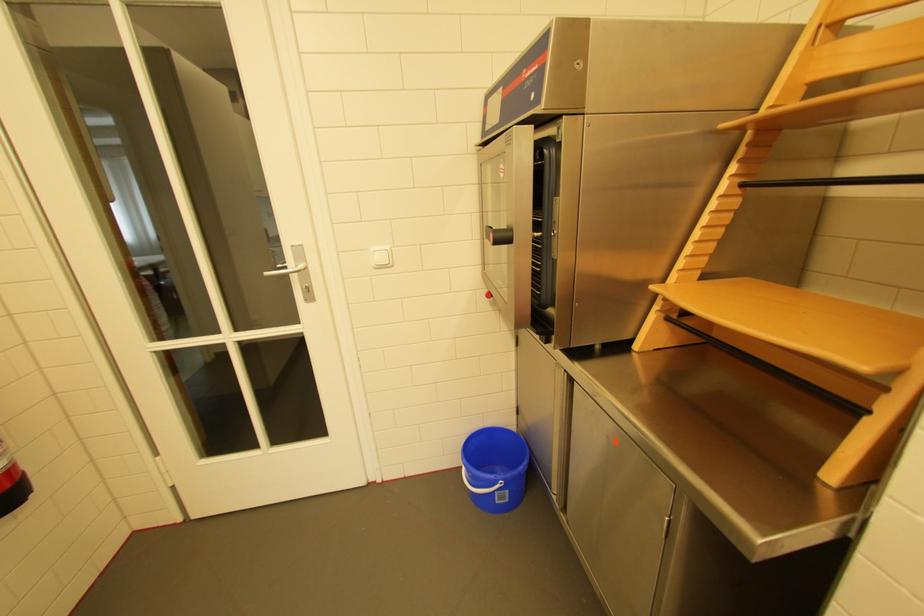
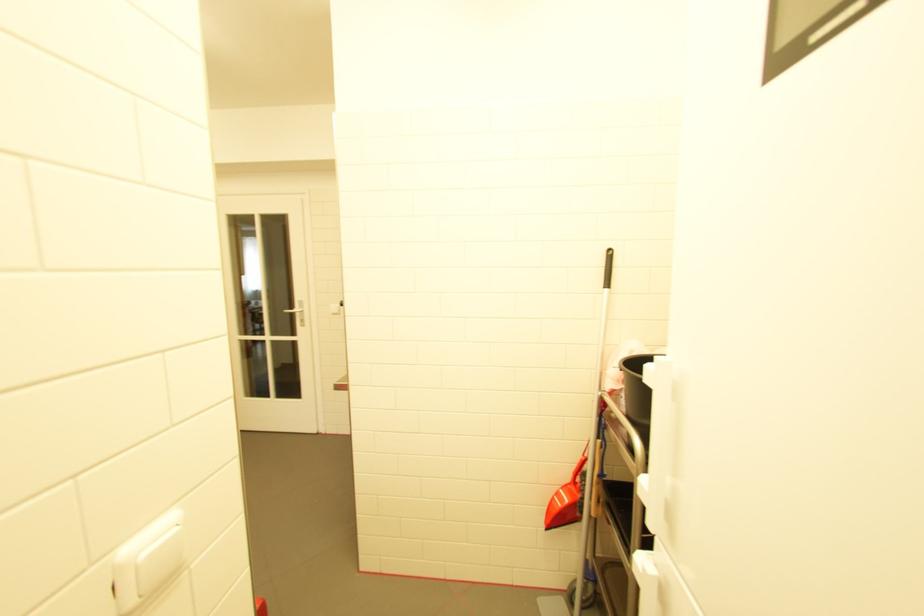
In a continuous first-person perspective shot, in which direction is the camera moving?

The cameraman moved toward right, backward.